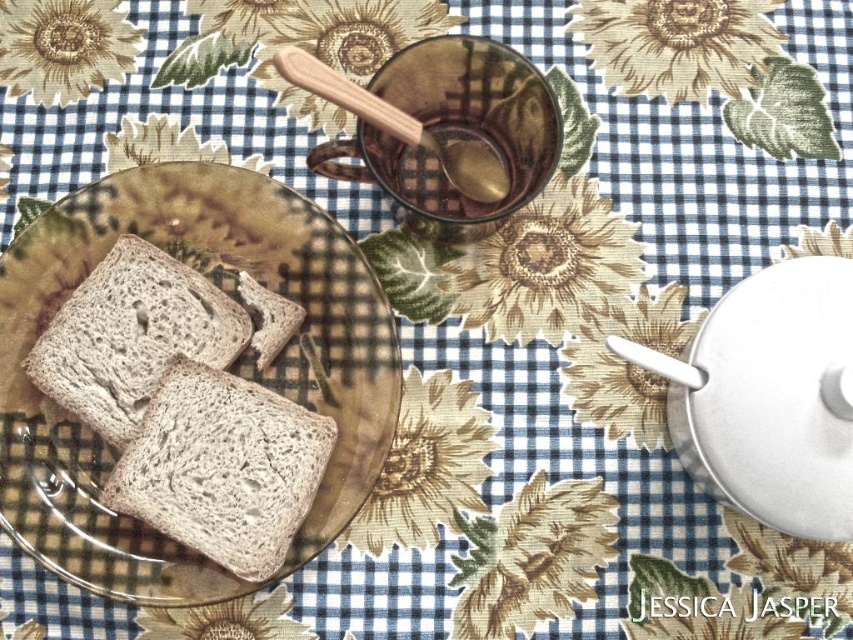
You are a chef preparing breakfast and need to place a new dish on the table. The table has coordinates where the top left corner is at position 0 and the bottom right is at position 1. You want to place the dish at the exact location of the point labeled as point (x=132, y=337). What object is located at that point?

The point (x=132, y=337) corresponds to the brown matte bread at left.